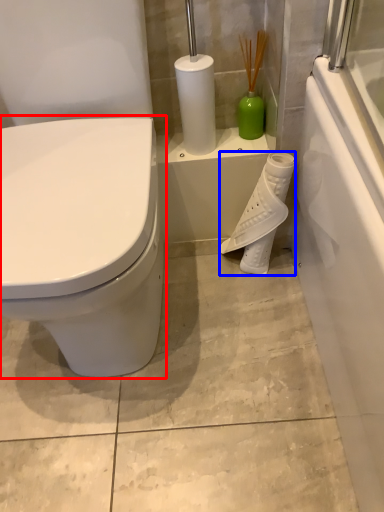
Question: Which object is closer to the camera taking this photo, toilet (highlighted by a red box) or toilet paper (highlighted by a blue box)?

Choices:
 (A) toilet
 (B) toilet paper

Answer: (A)